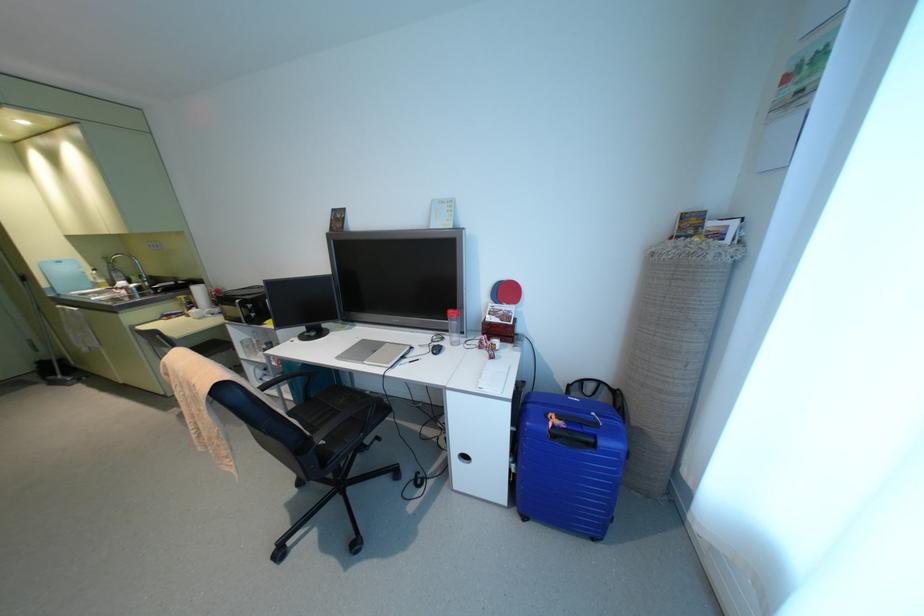
The width and height of the screenshot is (924, 616). What do you see at coordinates (329, 408) in the screenshot?
I see `the black chair sitting surface` at bounding box center [329, 408].